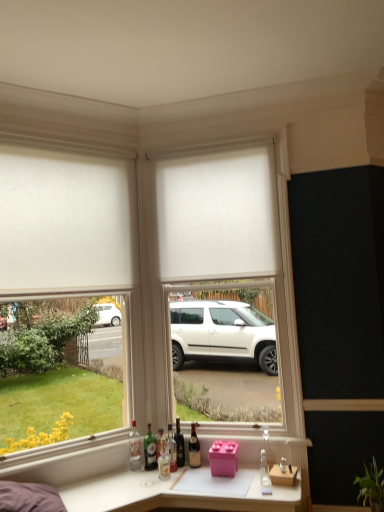
At what (x,y) coordinates should I click in order to perform the action: click on blank space above white matte blind at center (from a real-world perspective). Please return your answer as a coordinate pair (x, y). Looking at the image, I should click on (206, 148).